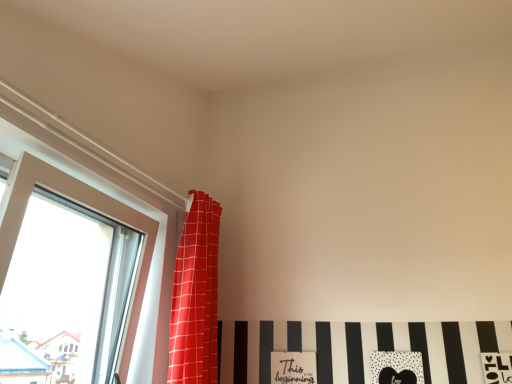
Question: Should I look upward or downward to see red checkered curtain at upper left?

Choices:
 (A) up
 (B) down

Answer: (B)

Question: From a real-world perspective, is red checkered curtain at upper left positioned over clear glass window at left based on gravity?

Choices:
 (A) yes
 (B) no

Answer: (A)

Question: Considering the relative positions of red checkered curtain at upper left and clear glass window at left in the image provided, is red checkered curtain at upper left to the right of clear glass window at left from the viewer's perspective?

Choices:
 (A) no
 (B) yes

Answer: (B)

Question: From the image's perspective, is red checkered curtain at upper left under clear glass window at left?

Choices:
 (A) yes
 (B) no

Answer: (A)

Question: Is clear glass window at left completely or partially inside red checkered curtain at upper left?

Choices:
 (A) yes
 (B) no

Answer: (B)

Question: Is red checkered curtain at upper left positioned beyond the bounds of clear glass window at left?

Choices:
 (A) yes
 (B) no

Answer: (A)

Question: Is the position of red checkered curtain at upper left less distant than that of clear glass window at left?

Choices:
 (A) no
 (B) yes

Answer: (A)

Question: Is clear glass window at left positioned before red checkered curtain at upper left?

Choices:
 (A) yes
 (B) no

Answer: (A)

Question: Does clear glass window at left turn towards red checkered curtain at upper left?

Choices:
 (A) no
 (B) yes

Answer: (B)

Question: Is the depth of clear glass window at left greater than that of red checkered curtain at upper left?

Choices:
 (A) yes
 (B) no

Answer: (B)

Question: Are clear glass window at left and red checkered curtain at upper left making contact?

Choices:
 (A) yes
 (B) no

Answer: (B)

Question: From the image's perspective, is clear glass window at left under red checkered curtain at upper left?

Choices:
 (A) no
 (B) yes

Answer: (A)

Question: Is clear glass window at left wider than red checkered curtain at upper left?

Choices:
 (A) no
 (B) yes

Answer: (A)

Question: Is clear glass window at left in front of or behind red checkered curtain at upper left in the image?

Choices:
 (A) front
 (B) behind

Answer: (A)